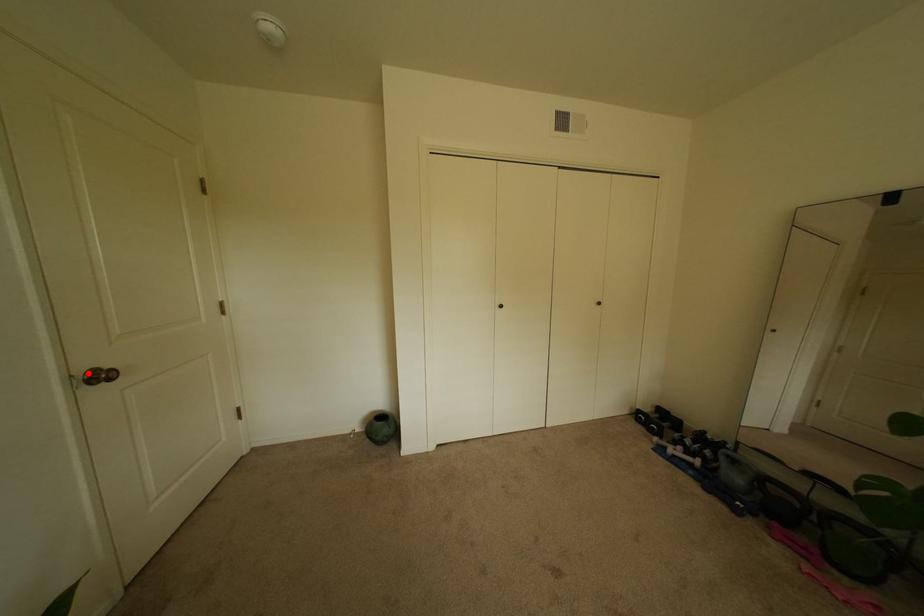
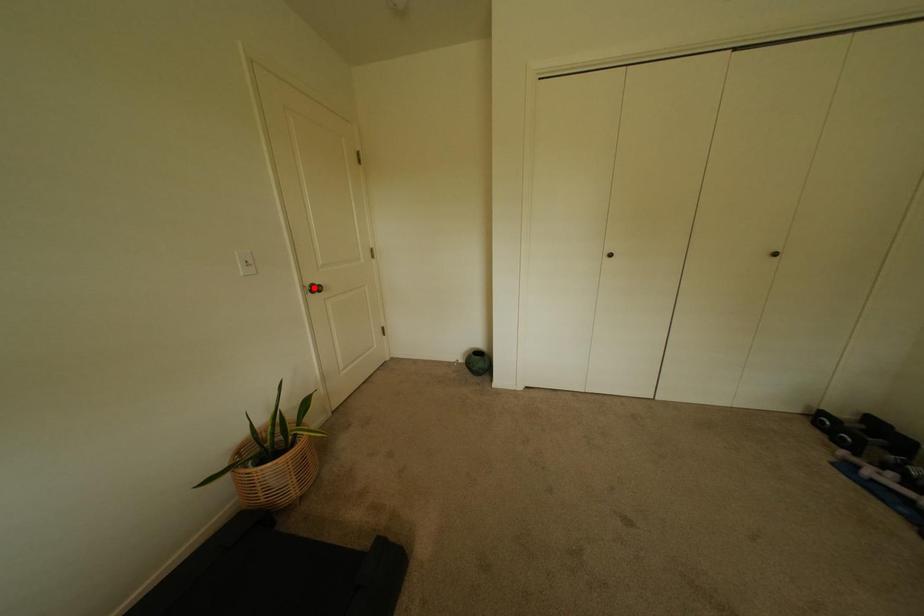
I am providing you with two images of the same scene from different viewpoints. A red point is marked on the first image and another point is marked on the second image. Do the highlighted points in image1 and image2 indicate the same real-world spot?

No